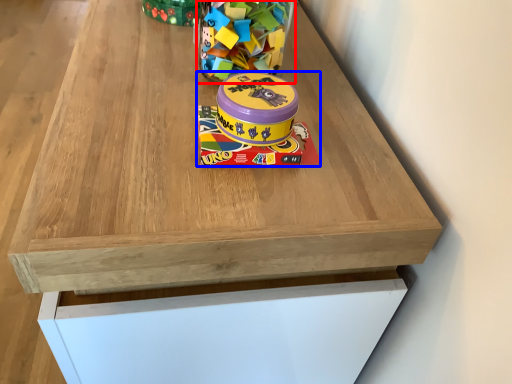
Question: Among these objects, which one is nearest to the camera, toy (highlighted by a red box) or toy (highlighted by a blue box)?

Choices:
 (A) toy
 (B) toy

Answer: (B)